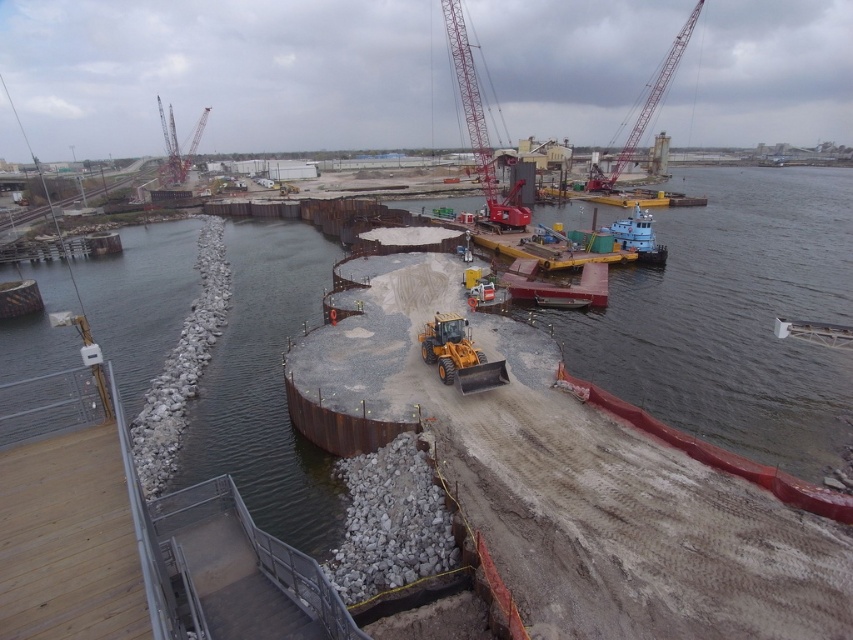
You are a construction worker planning to move a heavy load from the red metallic crane at upper center to the metallic gray crane at upper right. Considering their sizes, which crane can handle larger loads?

The metallic gray crane at upper right is larger than the red metallic crane at upper center, so it can handle larger loads.